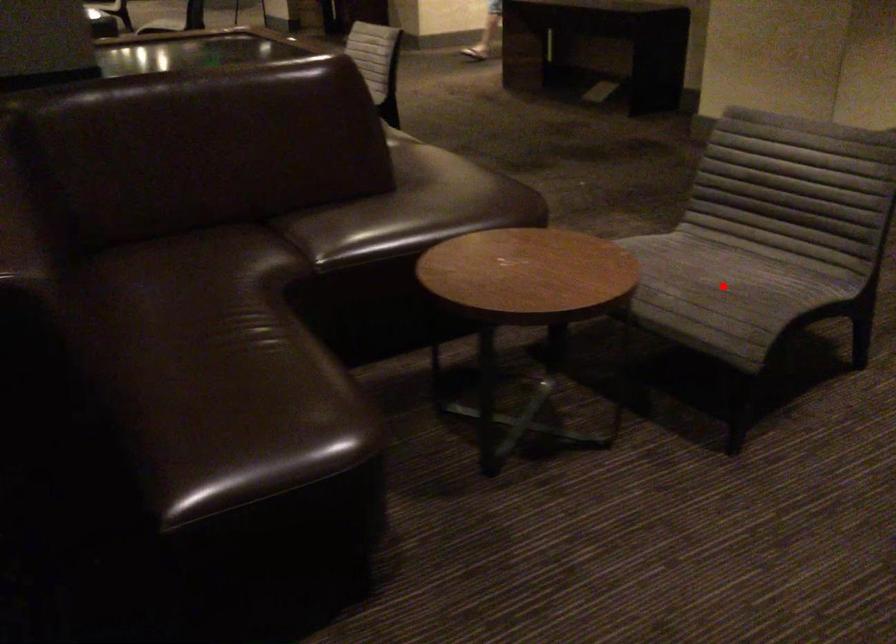
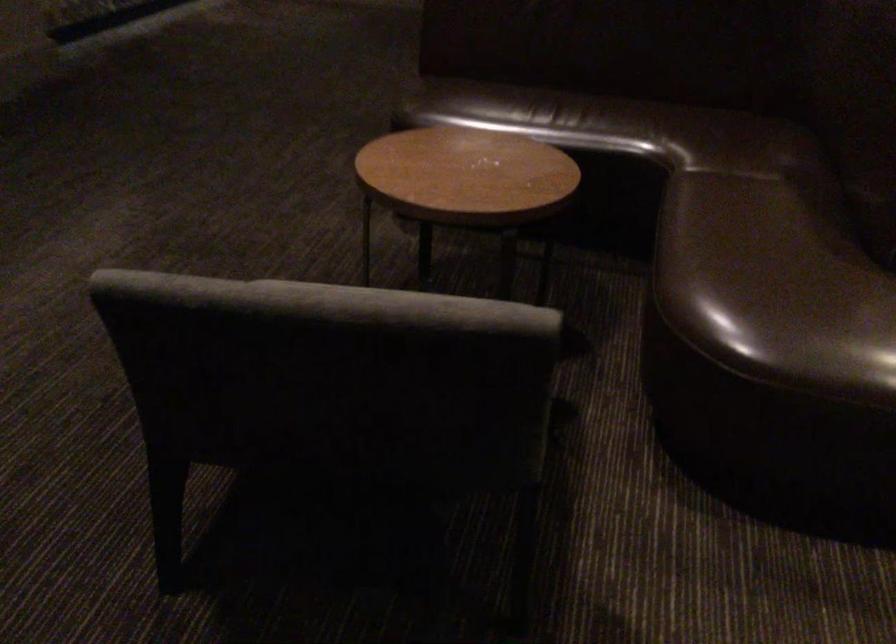
Question: I am providing you with two images of the same scene from different viewpoints. A red point is marked on the first image. Can you still see the location of the red point in image 2?

Choices:
 (A) Yes
 (B) No

Answer: (B)